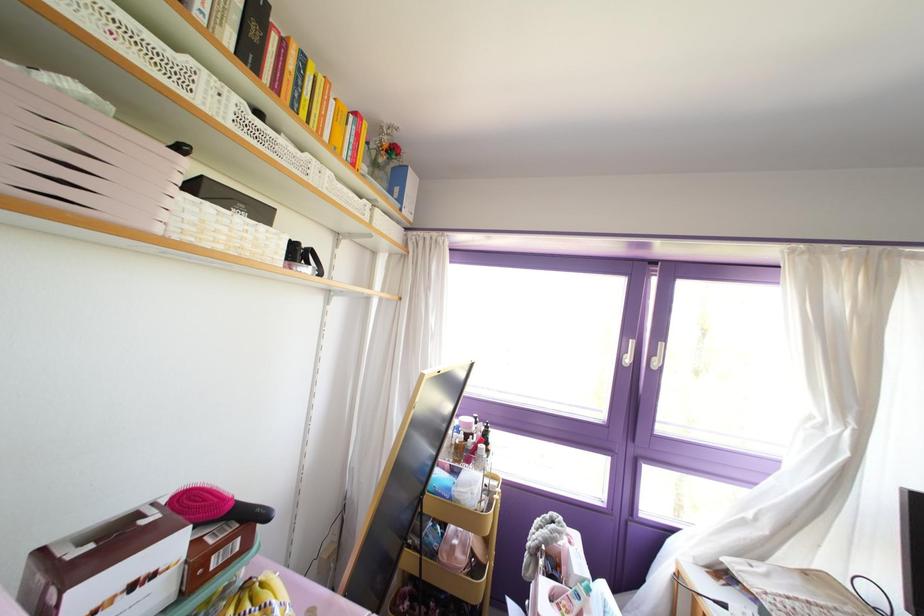
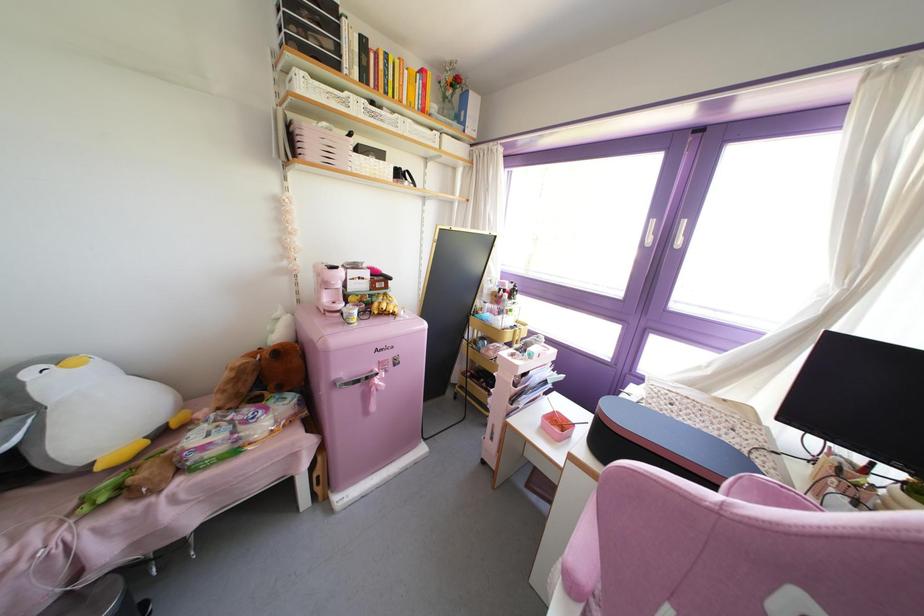
The point at (287,77) is marked in the first image. Where is the corresponding point in the second image?

(381, 74)